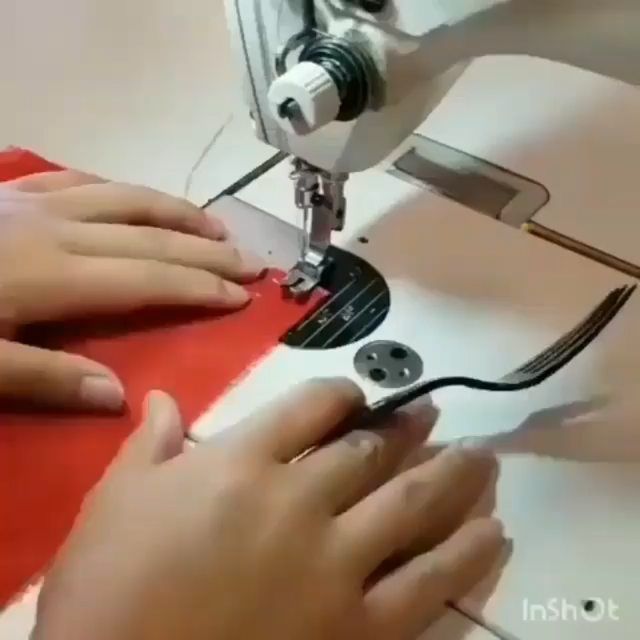
I want to click on fork, so click(534, 365).